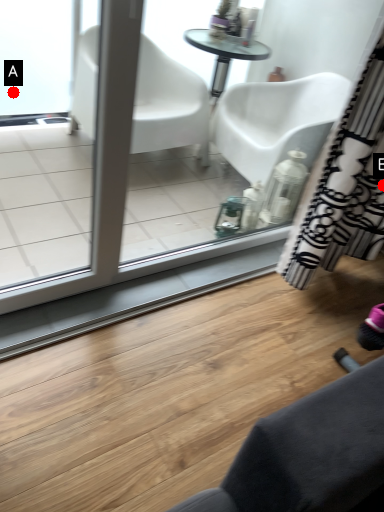
Question: Two points are circled on the image, labeled by A and B beside each circle. Which point is further to the camera?

Choices:
 (A) A is further
 (B) B is further

Answer: (A)